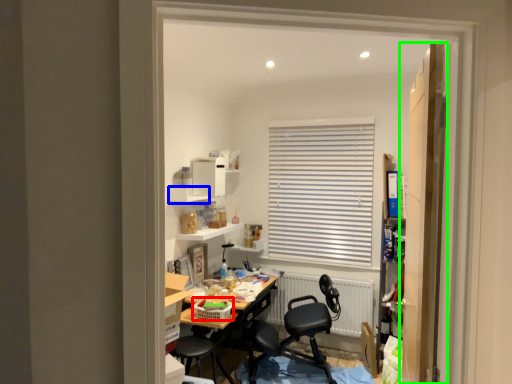
Question: Estimate the real-world distances between objects in this image. Which object is farther from laundry basket (highlighted by a red box), shelf (highlighted by a blue box) or door (highlighted by a green box)?

Choices:
 (A) shelf
 (B) door

Answer: (B)